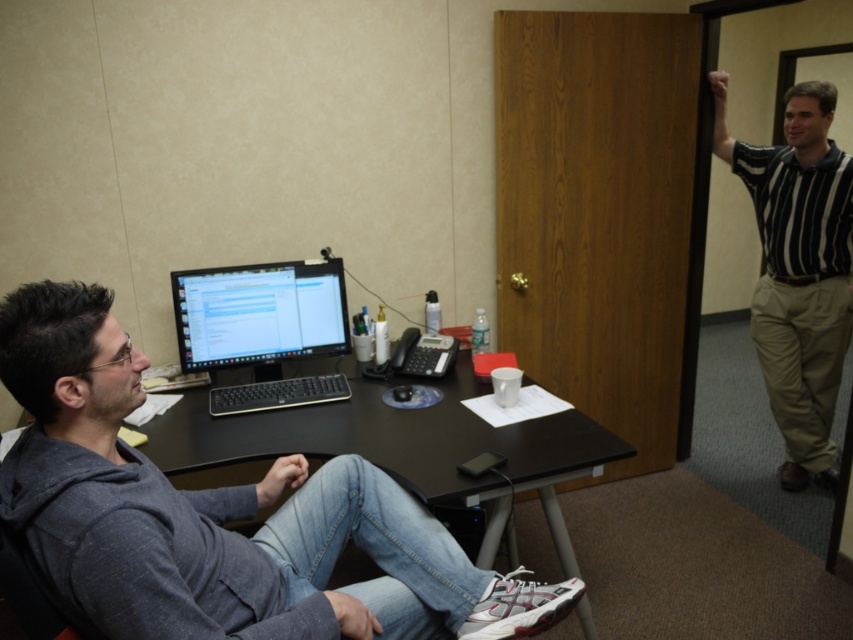
Can you confirm if gray hoodie at left is wider than matte black monitor at center?

Indeed, gray hoodie at left has a greater width compared to matte black monitor at center.

Which is below, gray hoodie at left or matte black monitor at center?

gray hoodie at left is below.

Is point (260, 612) closer to viewer compared to point (244, 284)?

Yes, it is.

I want to click on gray hoodie at left, so click(216, 515).

Who is more forward, (721, 76) or (200, 332)?

Point (200, 332) is more forward.

Image resolution: width=853 pixels, height=640 pixels. I want to click on striped shirt at right, so click(798, 269).

The width and height of the screenshot is (853, 640). I want to click on striped shirt at right, so click(x=798, y=269).

Does gray hoodie at left appear on the left side of striped shirt at right?

Indeed, gray hoodie at left is positioned on the left side of striped shirt at right.

Can you confirm if gray hoodie at left is wider than striped shirt at right?

Yes, gray hoodie at left is wider than striped shirt at right.

This screenshot has width=853, height=640. Find the location of `gray hoodie at left`. gray hoodie at left is located at coordinates (216, 515).